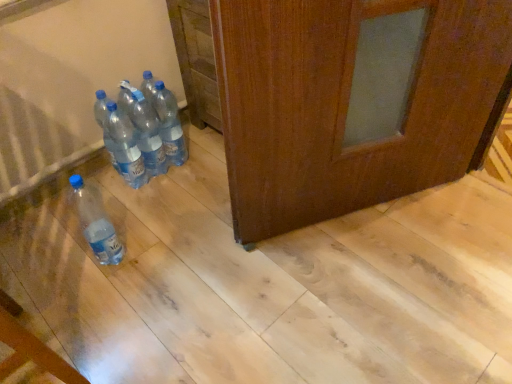
Identify the location of free space between matte plastic bottle at lower left, marked as the 1th bottle in a left-to-right arrangement, and transparent plastic bottles at center, which ranks as the 3th bottle in left-to-right order. (138, 210).